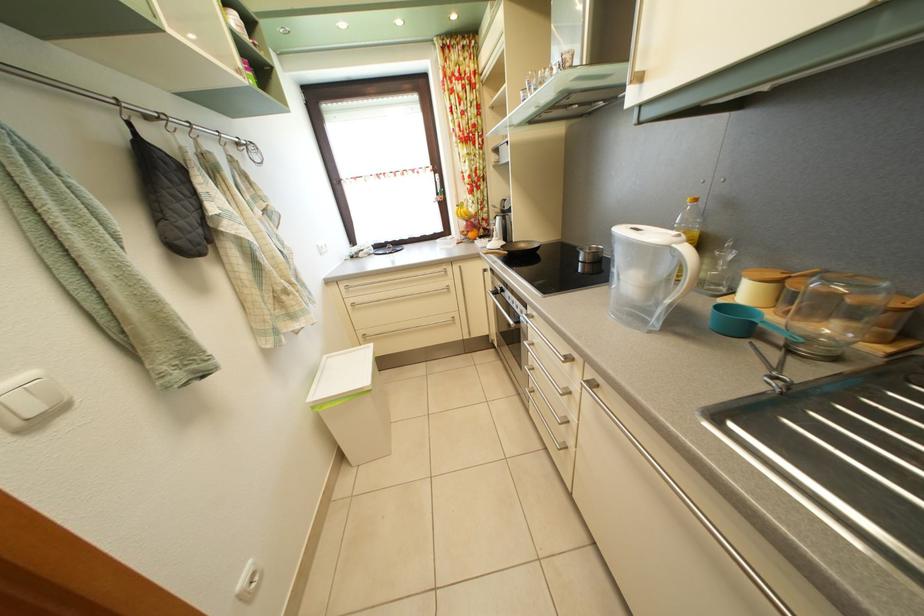
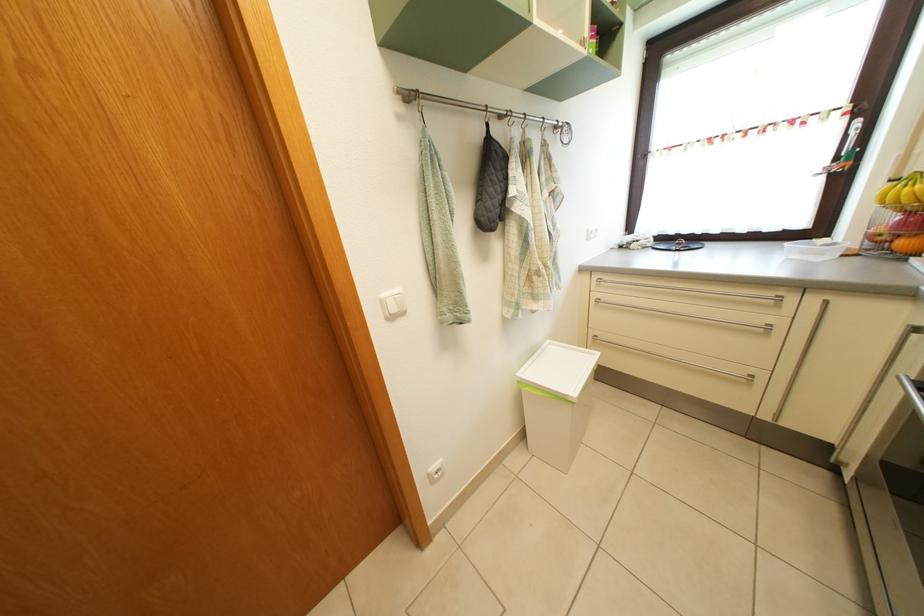
Where in the second image is the point corresponding to point 479,243 from the first image?

(910, 252)